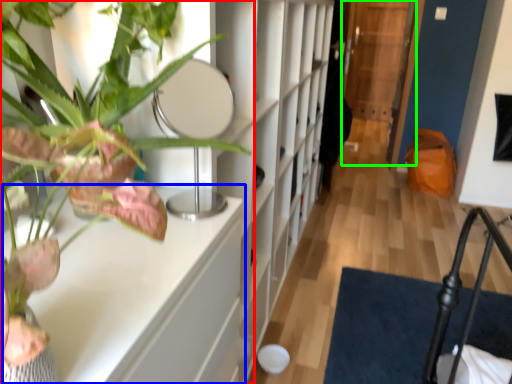
Question: Which object is positioned closest to houseplant (highlighted by a red box)? Select from table (highlighted by a blue box) and glass door (highlighted by a green box).

Choices:
 (A) table
 (B) glass door

Answer: (A)